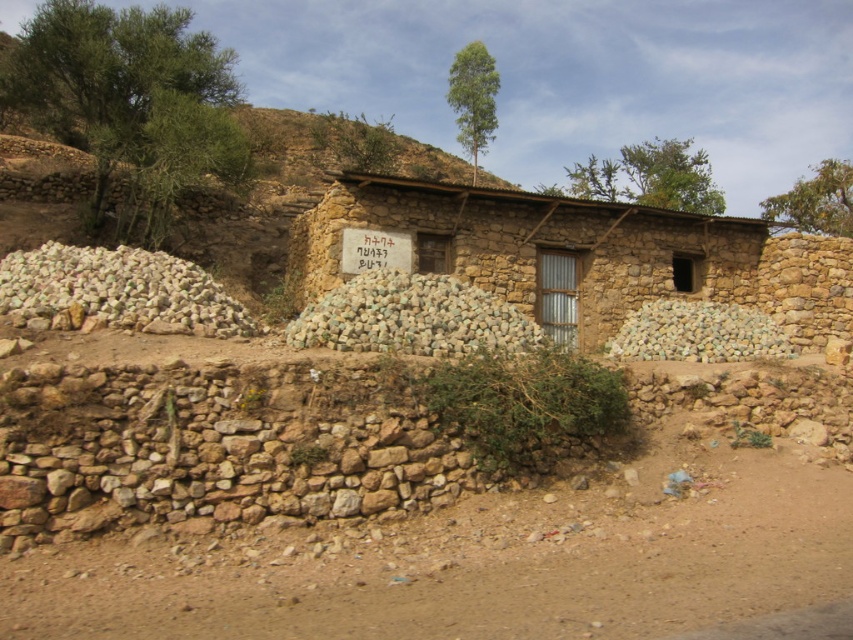
You are standing in front of the rustic stone building and want to determine the relative positions of two points marked on the ground. The first point is at coordinates point (584, 232) and the second is at point (723, 352). Which point is closer to you?

Point (584, 232) is closer to you because it is further to the viewer than point (723, 352).

You are a construction worker planning to move the white smooth stones at left and the white smooth stones at center to a new location. If you want to move the stones that are closer to the entrance of the rustic stone building first, which group should you move first?

The white smooth stones at center are closer to the entrance of the rustic stone building than the white smooth stones at left, so you should move the white smooth stones at center first.

You are a traveler passing by the rustic stone building and notice the brown mud hut at center and the white smooth stones at center. Which object occupies more space in the scene?

The brown mud hut at center is larger in size than the white smooth stones at center, so it occupies more space in the scene.